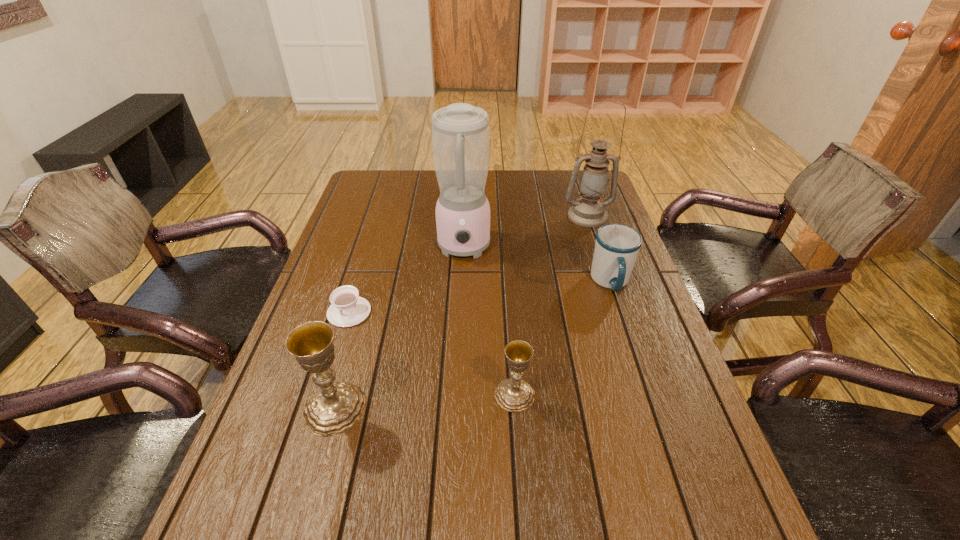
Image resolution: width=960 pixels, height=540 pixels. What are the coordinates of `free point located on the base of the third object from left to right near the control knob` in the screenshot? It's located at [x=457, y=388].

You are a GUI agent. You are given a task and a screenshot of the screen. Output one action in this format:
    pyautogui.click(x=<x>, y=<y>)
    Task: Click on the vacant area located 0.380m on the handle side of the mug
    The width and height of the screenshot is (960, 540).
    Given the screenshot: What is the action you would take?
    pyautogui.click(x=662, y=436)

At what (x,y) coordinates should I click in order to perform the action: click on free region located on the front of the farthest object. Please return your answer as a coordinate pair (x, y). The height and width of the screenshot is (540, 960). Looking at the image, I should click on (608, 278).

At what (x,y) coordinates should I click in order to perform the action: click on vacant space located on the handle side of the shortest object. Please return your answer as a coordinate pair (x, y). Image resolution: width=960 pixels, height=540 pixels. Looking at the image, I should click on (300, 469).

What are the coordinates of `chalice located at the left edge` in the screenshot? It's located at (334, 407).

Where is `teacup at the left edge`? The height and width of the screenshot is (540, 960). teacup at the left edge is located at coordinates (347, 308).

Where is `mug that is positioned at the right edge`? The width and height of the screenshot is (960, 540). mug that is positioned at the right edge is located at coordinates (617, 245).

I want to click on oil lamp located in the right edge section of the desktop, so click(589, 211).

In the image, there is a desktop. What are the coordinates of `vacant area at the far edge` in the screenshot? It's located at (488, 181).

This screenshot has width=960, height=540. I want to click on free space at the near edge of the desktop, so pyautogui.click(x=583, y=487).